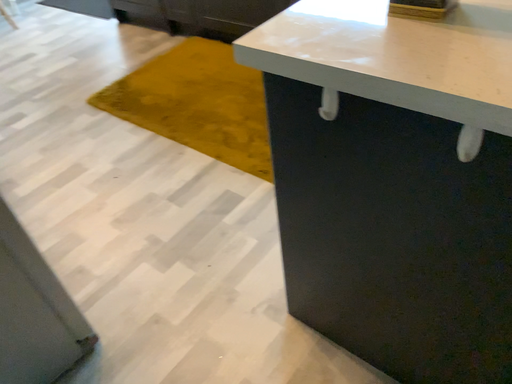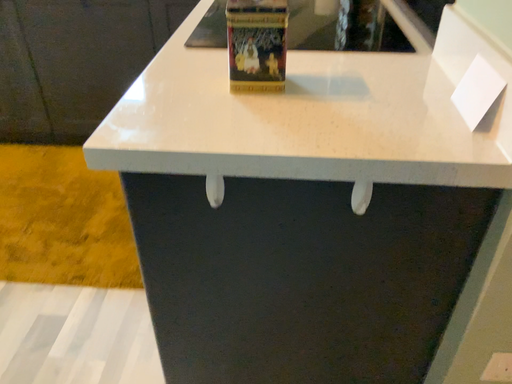
Question: How did the camera likely rotate when shooting the video?

Choices:
 (A) rotated downward
 (B) rotated upward

Answer: (B)